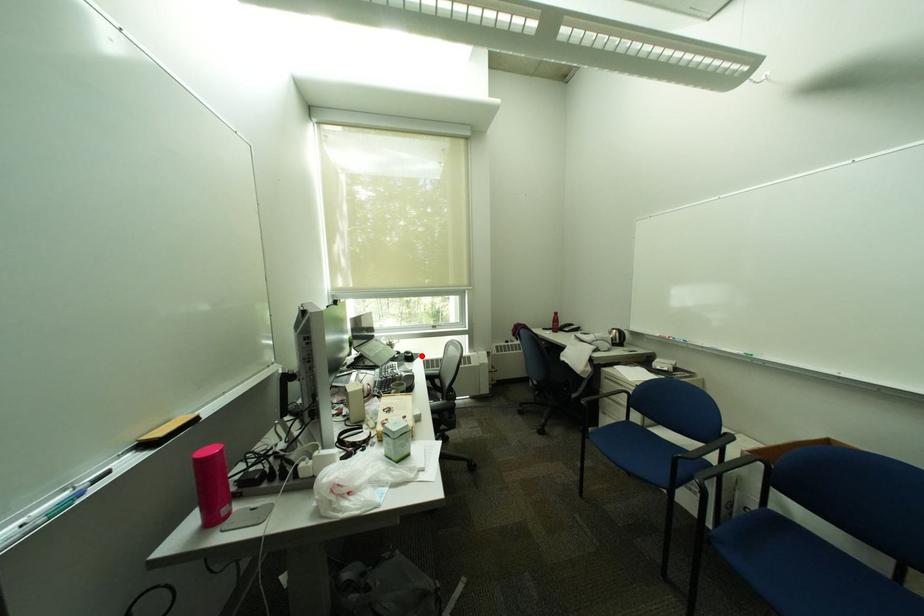
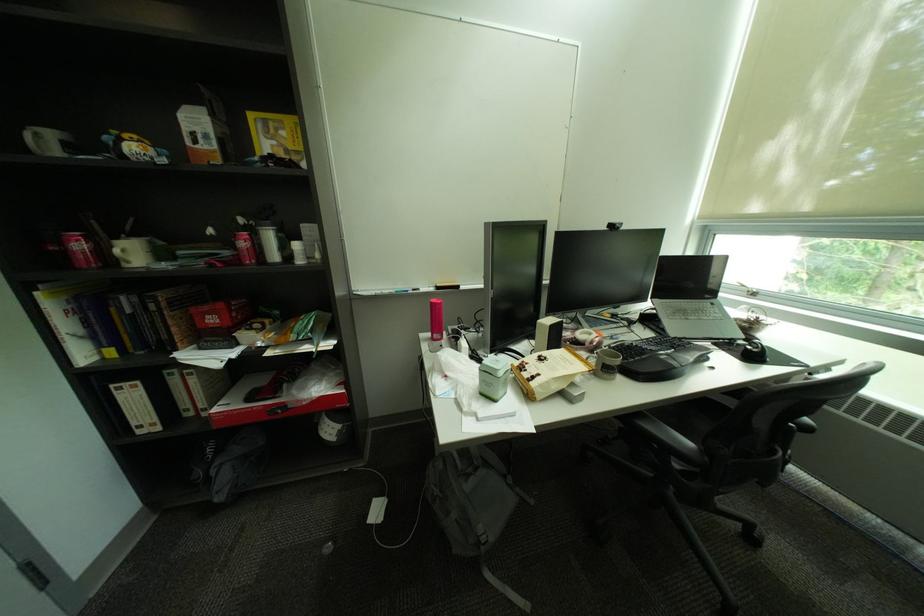
Where in the second image is the point corresponding to the highlighted location from the first image?

(766, 352)